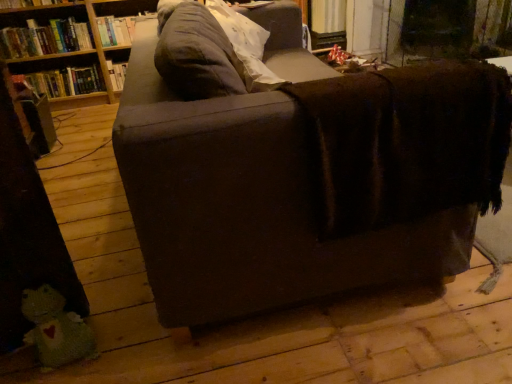
The width and height of the screenshot is (512, 384). In order to click on dark brown fabric couch at center in this screenshot , I will do `click(298, 168)`.

Measure the distance between dark brown fabric couch at center and camera.

They are 35.35 inches apart.

This screenshot has height=384, width=512. What do you see at coordinates (45, 38) in the screenshot?
I see `hardcover book at upper left, the second book from the bottom` at bounding box center [45, 38].

Describe the element at coordinates (119, 29) in the screenshot. I see `hardcover book at upper left, which is the 1th book from top to bottom` at that location.

This screenshot has width=512, height=384. I want to click on brown fabric shelf at upper left, so click(x=440, y=30).

Identify the location of the 3rd book counting from the left side of the brown fabric shelf at upper left. (45, 38).

Does hardcover book at upper left, the second book from the bottom, come in front of brown fabric shelf at upper left?

No, hardcover book at upper left, the second book from the bottom, is further to the viewer.

Considering the points (48, 34) and (407, 48), which point is behind, point (48, 34) or point (407, 48)?

Positioned behind is point (407, 48).

Does hardcover book at upper left, which ranks as the 2th book in top-to-bottom order, appear on the left side of brown fabric shelf at upper left?

Indeed, hardcover book at upper left, which ranks as the 2th book in top-to-bottom order, is positioned on the left side of brown fabric shelf at upper left.

How far apart are hardcover book at upper left, the second book from the bottom, and green knitted toy at lower left?

hardcover book at upper left, the second book from the bottom, and green knitted toy at lower left are 2.41 meters apart from each other.

Is hardcover book at upper left, the second book from the bottom, not inside green knitted toy at lower left?

hardcover book at upper left, the second book from the bottom, lies outside green knitted toy at lower left's area.

How many degrees apart are the facing directions of hardcover book at upper left, which ranks as the 2th book in top-to-bottom order, and green knitted toy at lower left?

The angle between the facing direction of hardcover book at upper left, which ranks as the 2th book in top-to-bottom order, and the facing direction of green knitted toy at lower left is 22.9 degrees.

Does hardcover book at upper left, which ranks as the 2th book in top-to-bottom order, have a greater height compared to green knitted toy at lower left?

Yes.

Based on their positions, is soft gray pillow at upper center located to the left or right of dark brown fabric couch at center?

From the image, it's evident that soft gray pillow at upper center is to the left of dark brown fabric couch at center.

Is soft gray pillow at upper center located outside dark brown fabric couch at center?

No, soft gray pillow at upper center is inside dark brown fabric couch at center's boundary.

From a real-world perspective, is soft gray pillow at upper center physically located above or below dark brown fabric couch at center?

soft gray pillow at upper center is situated higher than dark brown fabric couch at center in the real world.

Considering the relative sizes of soft gray pillow at upper center and dark brown fabric couch at center in the image provided, is soft gray pillow at upper center bigger than dark brown fabric couch at center?

Incorrect, soft gray pillow at upper center is not larger than dark brown fabric couch at center.

Is green knitted toy at lower left taller or shorter than hardcover book at upper left, which appears as the 3th book when ordered from the bottom?

green knitted toy at lower left is taller than hardcover book at upper left, which appears as the 3th book when ordered from the bottom.

Is green knitted toy at lower left positioned before hardcover book at upper left, which appears as the 3th book when ordered from the bottom?

Yes.

Does green knitted toy at lower left contain hardcover book at upper left, which is the 1th book from top to bottom?

No, hardcover book at upper left, which is the 1th book from top to bottom, is not a part of green knitted toy at lower left.

How much distance is there between hardcover book at left, which is the first book from bottom to top, and green knitted toy at lower left?

The distance of hardcover book at left, which is the first book from bottom to top, from green knitted toy at lower left is 7.89 feet.

Is point (45, 92) less distant than point (49, 287)?

No.

How many degrees apart are the facing directions of hardcover book at left, the third book in the top-to-bottom sequence, and green knitted toy at lower left?

The angular difference between hardcover book at left, the third book in the top-to-bottom sequence, and green knitted toy at lower left is 22.9 degrees.

Is hardcover book at left, the third book in the top-to-bottom sequence, inside or outside of green knitted toy at lower left?

hardcover book at left, the third book in the top-to-bottom sequence, is not inside green knitted toy at lower left, it's outside.

Considering the relative sizes of green knitted toy at lower left and dark brown fabric couch at center in the image provided, is green knitted toy at lower left thinner than dark brown fabric couch at center?

Yes.

Is green knitted toy at lower left shorter than dark brown fabric couch at center?

Indeed, green knitted toy at lower left has a lesser height compared to dark brown fabric couch at center.

From a real-world perspective, is green knitted toy at lower left on dark brown fabric couch at center?

No, from a real-world perspective, green knitted toy at lower left is not on top of dark brown fabric couch at center.

Can you tell me how much green knitted toy at lower left and dark brown fabric couch at center differ in facing direction?

There is a 67.7-degree angle between the facing directions of green knitted toy at lower left and dark brown fabric couch at center.

From the picture: Can you confirm if hardcover book at left, which is the first book from bottom to top, is wider than hardcover book at upper left, which appears as the 3th book when ordered from the bottom?

No, hardcover book at left, which is the first book from bottom to top, is not wider than hardcover book at upper left, which appears as the 3th book when ordered from the bottom.

Is hardcover book at left, the third book in the top-to-bottom sequence, spatially inside hardcover book at upper left, which is the 1th book from top to bottom, or outside of it?

The correct answer is: outside.

Between hardcover book at left, the third book in the top-to-bottom sequence, and hardcover book at upper left, which appears as the 3th book when ordered from the bottom, which one appears on the right side from the viewer's perspective?

hardcover book at upper left, which appears as the 3th book when ordered from the bottom, is more to the right.

The image size is (512, 384). What are the coordinates of `book that is the 2nd object above the brown fabric shelf at upper left (from a real-world perspective)` in the screenshot? It's located at coord(45,38).

Identify the location of the 3rd book to the left of the green knitted toy at lower left, counting from the anchor's position. (45, 38).

Based on their spatial positions, is green knitted toy at lower left or hardcover book at left, the third book in the top-to-bottom sequence, closer to hardcover book at upper left, the second book from the bottom?

hardcover book at left, the third book in the top-to-bottom sequence, is closer to hardcover book at upper left, the second book from the bottom.

From the image, which object appears to be nearer to green knitted toy at lower left, dark brown fabric couch at center or hardcover book at left, which is the first book from bottom to top?

Based on the image, dark brown fabric couch at center appears to be nearer to green knitted toy at lower left.

When comparing their distances from hardcover book at upper left, which ranks as the 2th book in top-to-bottom order, does dark brown fabric couch at center or brown fabric shelf at upper left seem further?

Among the two, dark brown fabric couch at center is located further to hardcover book at upper left, which ranks as the 2th book in top-to-bottom order.

From the image, which object appears to be nearer to dark brown fabric couch at center, soft gray pillow at upper center or hardcover book at upper left, which is the 1th book from top to bottom?

soft gray pillow at upper center.

Estimate the real-world distances between objects in this image. Which object is closer to soft gray pillow at upper center, hardcover book at upper left, which appears as the 3th book when ordered from the bottom, or hardcover book at upper left, the second book from the bottom?

hardcover book at upper left, which appears as the 3th book when ordered from the bottom, lies closer to soft gray pillow at upper center than the other object.

From the image, which object appears to be farther from hardcover book at upper left, the second book from the bottom, hardcover book at upper left, which appears as the 3th book when ordered from the bottom, or hardcover book at left, the third book in the top-to-bottom sequence?

hardcover book at upper left, which appears as the 3th book when ordered from the bottom, is further to hardcover book at upper left, the second book from the bottom.

Based on their spatial positions, is dark brown fabric couch at center or soft gray pillow at upper center closer to brown fabric shelf at upper left?

soft gray pillow at upper center lies closer to brown fabric shelf at upper left than the other object.

Estimate the real-world distances between objects in this image. Which object is closer to hardcover book at upper left, which appears as the 3th book when ordered from the bottom, brown fabric shelf at upper left or green knitted toy at lower left?

The object closer to hardcover book at upper left, which appears as the 3th book when ordered from the bottom, is brown fabric shelf at upper left.

Find the location of a particular element. pillow located between green knitted toy at lower left and hardcover book at upper left, which is the 1th book from top to bottom, in the depth direction is located at coordinates (246, 46).

You are a GUI agent. You are given a task and a screenshot of the screen. Output one action in this format:
    pyautogui.click(x=<x>, y=<y>)
    Task: Click on the toy positioned between dark brown fabric couch at center and brown fabric shelf at upper left from near to far
    
    Given the screenshot: What is the action you would take?
    [56, 328]

I want to click on shelf positioned between green knitted toy at lower left and hardcover book at left, the third book in the top-to-bottom sequence, from near to far, so click(x=440, y=30).

Locate an element on the screen. This screenshot has width=512, height=384. pillow between dark brown fabric couch at center and brown fabric shelf at upper left from front to back is located at coordinates (246, 46).